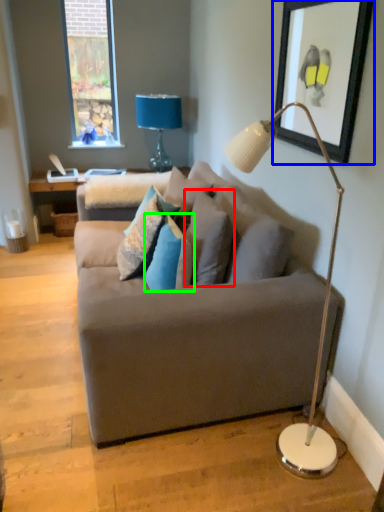
Question: Which is nearer to the pillow (highlighted by a red box)? picture frame (highlighted by a blue box) or pillow (highlighted by a green box).

Choices:
 (A) picture frame
 (B) pillow

Answer: (B)